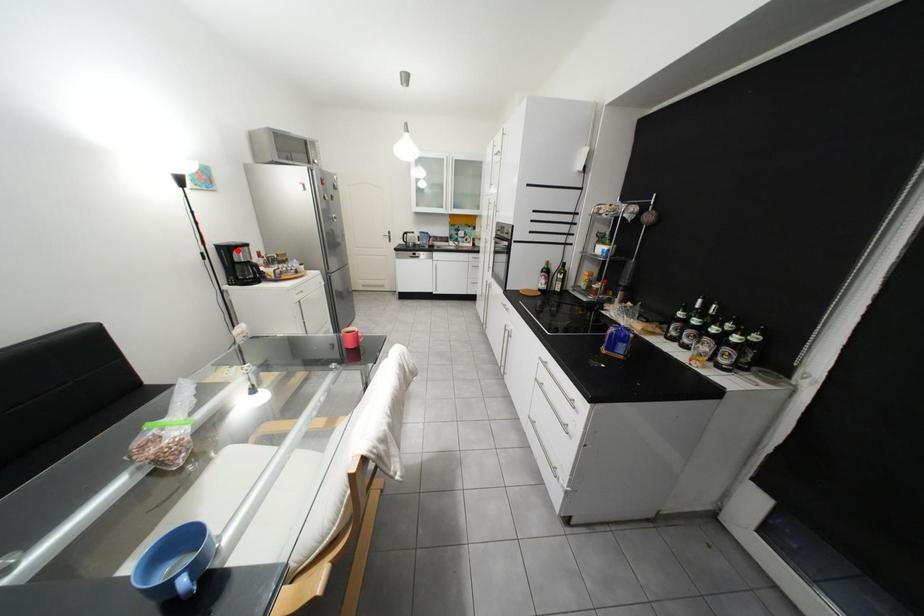
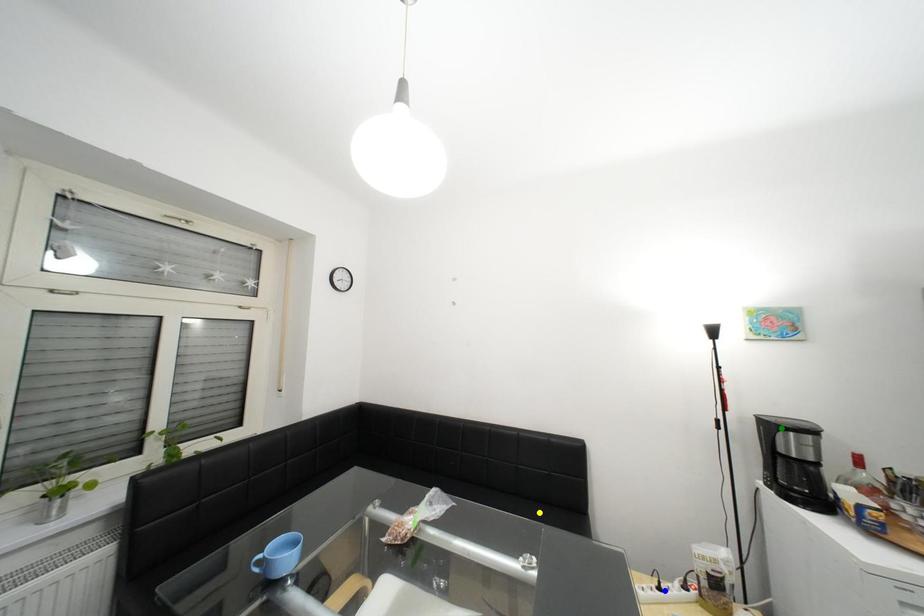
Question: I am providing you with two images of the same scene from different viewpoints. A red point is marked on the first image. You are given multiple points on the second image. In image 2, which mark is for the same physical point as the one in image 1?

Choices:
 (A) blue point
 (B) yellow point
 (C) green point

Answer: (C)